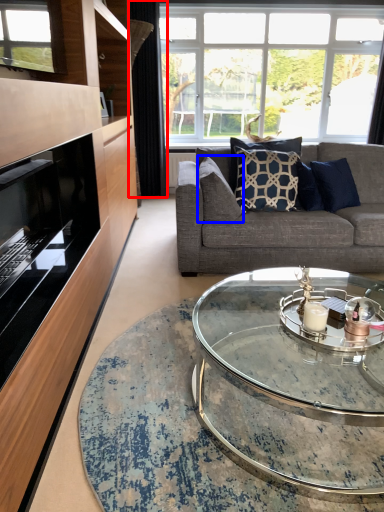
Question: Which object appears closest to the camera in this image, curtain (highlighted by a red box) or pillow (highlighted by a blue box)?

Choices:
 (A) curtain
 (B) pillow

Answer: (B)